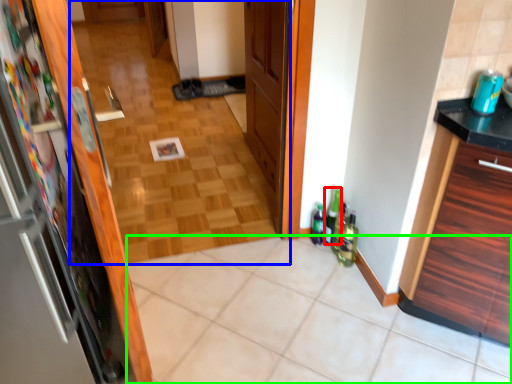
Question: Which object is positioned farthest from bottle (highlighted by a red box)? Select from corridor (highlighted by a blue box) and tile (highlighted by a green box).

Choices:
 (A) corridor
 (B) tile

Answer: (A)